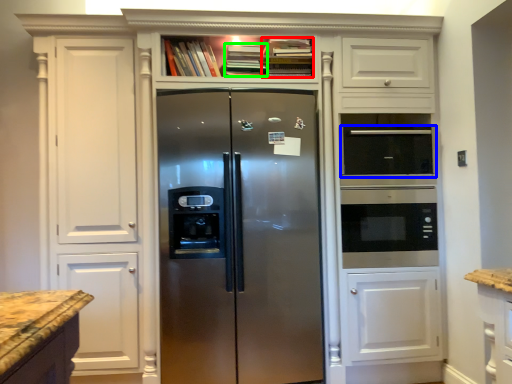
Question: Which is nearer to the book (highlighted by a red box)? appliance (highlighted by a blue box) or book (highlighted by a green box).

Choices:
 (A) appliance
 (B) book

Answer: (B)